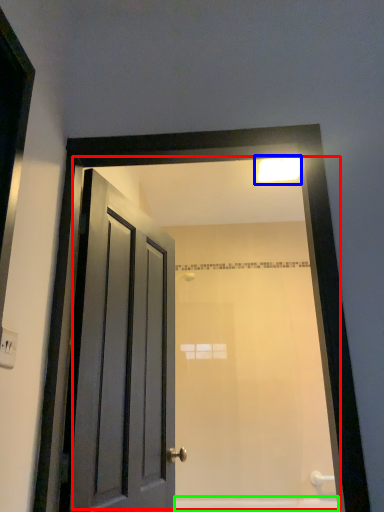
Question: Which object is positioned closest to mirror (highlighted by a red box)? Select from light fixture (highlighted by a blue box) and bath (highlighted by a green box).

Choices:
 (A) light fixture
 (B) bath

Answer: (A)